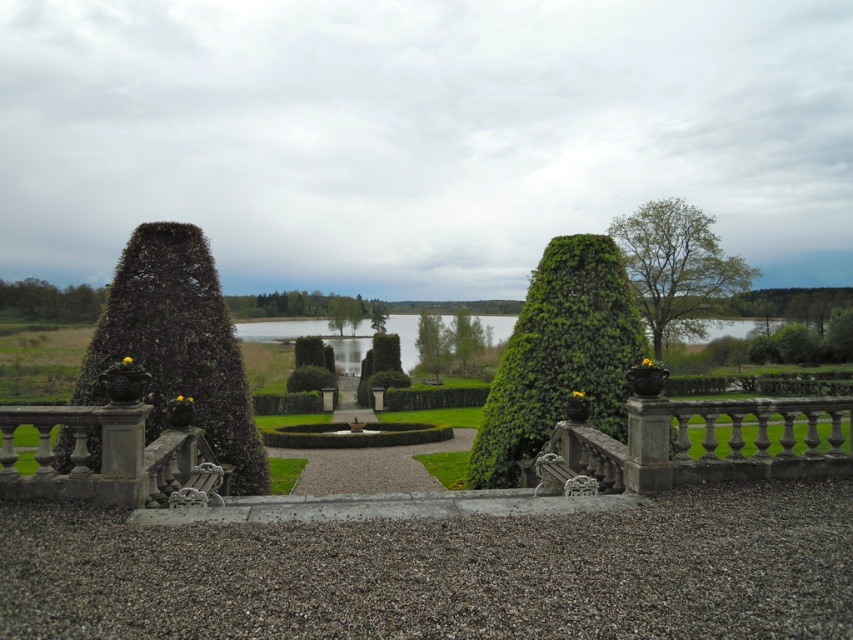
You are a gardener who needs to trim the green leafy bush at center and the stone balustrade at lower left. Which object requires you to use a taller ladder?

The green leafy bush at center requires a taller ladder because it is taller than the stone balustrade at lower left.

You are designing a garden layout and need to place a new sculpture that requires a space wider than the green leafy bush at left. Can the green leafy tree at upper left accommodate the sculpture in terms of width?

The green leafy bush at left is narrower than the green leafy tree at upper left, so the sculpture requiring more width than the green leafy bush at left can be placed at the green leafy tree at upper left since it is wider.

You are standing on the raised terrace and want to know if the stone balustrade at lower left is in the shadow of the green leafy tree at upper right. Can you determine this based on their positions?

The stone balustrade at lower left is positioned under the green leafy tree at upper right, so it is likely in its shadow depending on the time of day and sun angle.